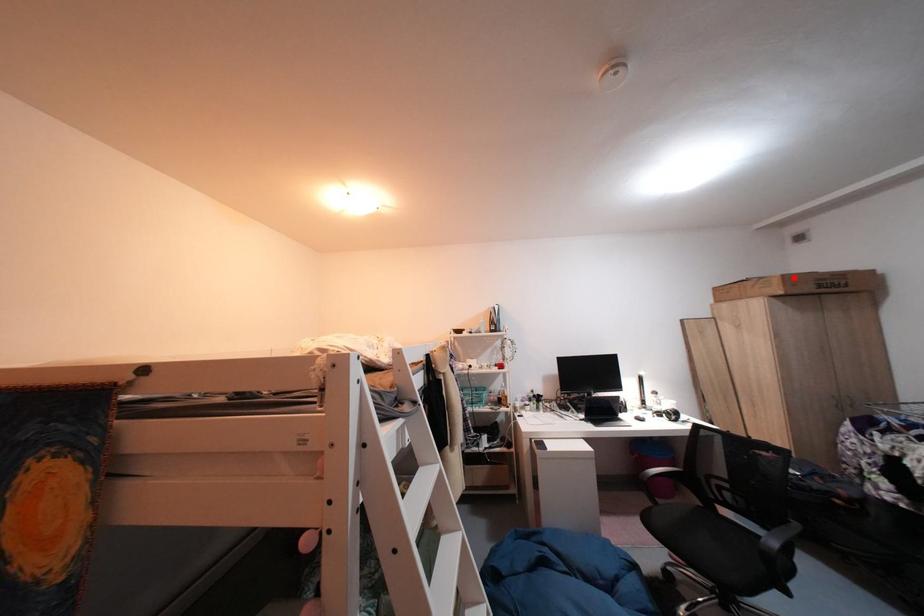
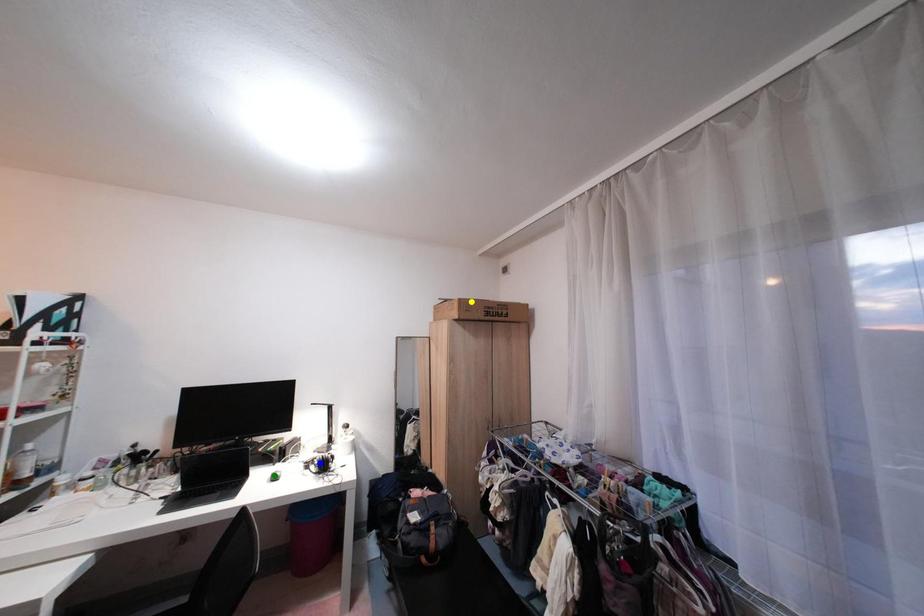
Question: I am providing you with two images of the same scene from different viewpoints. A red point is marked on the first image. You are given multiple points on the second image. Which spot in image 2 lines up with the point in image 1?

Choices:
 (A) blue point
 (B) yellow point
 (C) green point

Answer: (B)